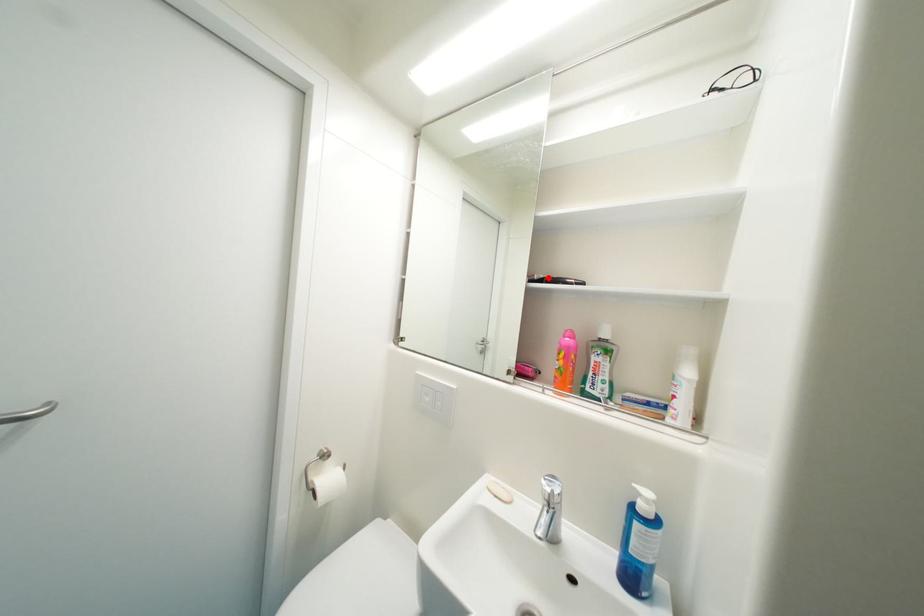
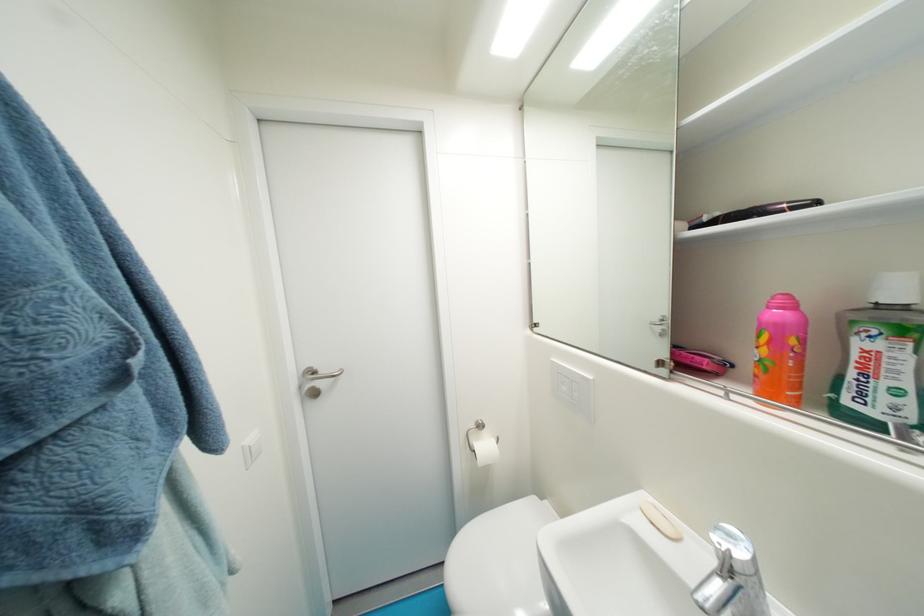
Where in the second image is the point corresponding to the highlighted location from the first image?

(724, 216)